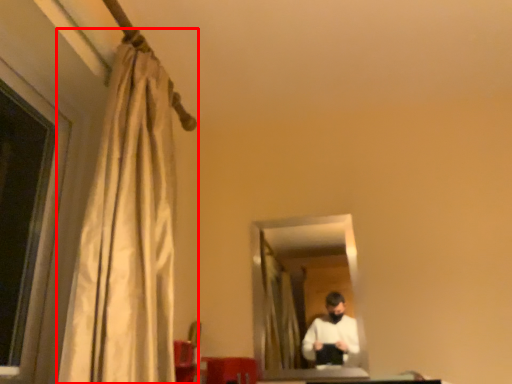
Question: From the image's perspective, where is curtain (annotated by the red box) located in relation to mirror in the image?

Choices:
 (A) below
 (B) above

Answer: (B)